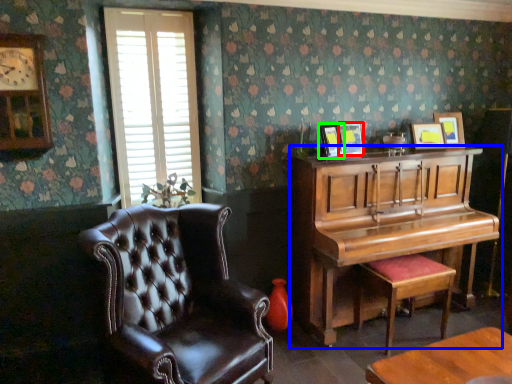
Question: Considering the real-world distances, which object is closest to picture frame (highlighted by a red box)? piano (highlighted by a blue box) or picture frame (highlighted by a green box).

Choices:
 (A) piano
 (B) picture frame

Answer: (B)